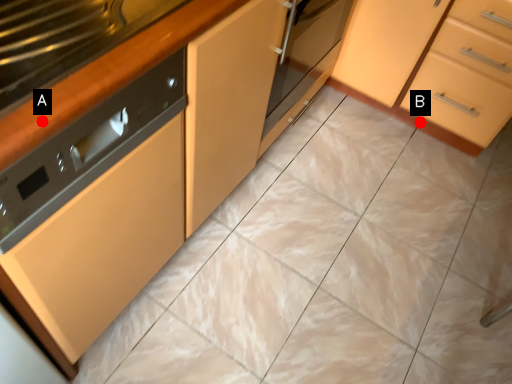
Question: Two points are circled on the image, labeled by A and B beside each circle. Among these points, which one is farthest from the camera?

Choices:
 (A) A is further
 (B) B is further

Answer: (B)